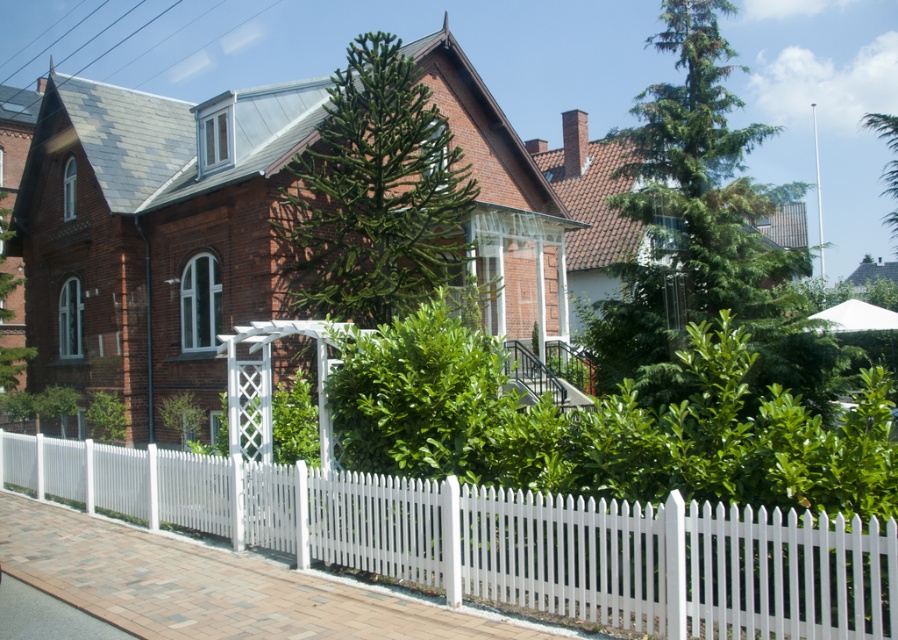
Who is more forward, (x=723, y=90) or (x=296, y=177)?

Point (x=723, y=90) is more forward.

Is green needle-like at upper right thinner than green leafy tree at center?

No.

At what (x,y) coordinates should I click in order to perform the action: click on green needle-like at upper right. Please return your answer as a coordinate pair (x, y). The width and height of the screenshot is (898, 640). Looking at the image, I should click on (702, 232).

Locate an element on the screen. green needle-like at upper right is located at coordinates (702, 232).

Does white picket fence at lower center come behind green leafy tree at center?

No, white picket fence at lower center is closer to the viewer.

Where is `white picket fence at lower center`? white picket fence at lower center is located at coordinates (506, 540).

Find the location of a particular element. The height and width of the screenshot is (640, 898). white picket fence at lower center is located at coordinates (506, 540).

Is point (587, 320) farther from camera compared to point (18, 324)?

No, it is in front of (18, 324).

Consider the image. Between green needle-like at upper right and green leafy tree at left, which one appears on the right side from the viewer's perspective?

From the viewer's perspective, green needle-like at upper right appears more on the right side.

Describe the element at coordinates (702, 232) in the screenshot. The height and width of the screenshot is (640, 898). I see `green needle-like at upper right` at that location.

I want to click on green needle-like at upper right, so click(x=702, y=232).